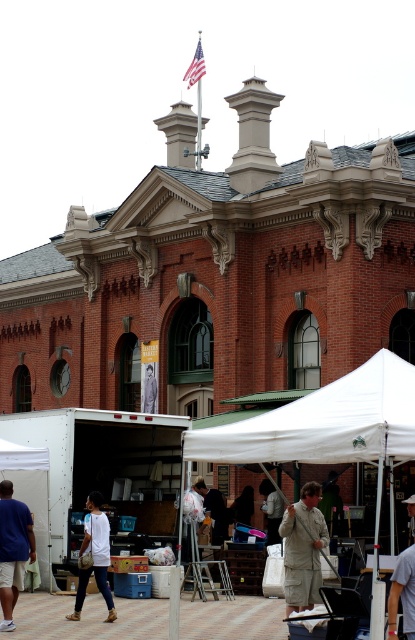
Question: Which of the following is the farthest from the observer?

Choices:
 (A) (34, 547)
 (B) (239, 512)
 (C) (326, 436)
 (D) (107, 605)

Answer: (B)

Question: Is white matte truck at lower left positioned in front of matte black mask at center?

Choices:
 (A) no
 (B) yes

Answer: (B)

Question: Based on their relative distances, which object is nearer to the matte black mask at center?

Choices:
 (A) white fabric canopy at center
 (B) khaki pants at center

Answer: (B)

Question: Which point is farther to the camera?

Choices:
 (A) (276, 512)
 (B) (300, 445)
 (C) (290, 605)

Answer: (A)

Question: Is blue cotton shirt at lower left to the right of khaki pants at center from the viewer's perspective?

Choices:
 (A) yes
 (B) no

Answer: (B)

Question: Is blue cotton shirt at lower left further to the viewer compared to matte black mask at center?

Choices:
 (A) yes
 (B) no

Answer: (B)